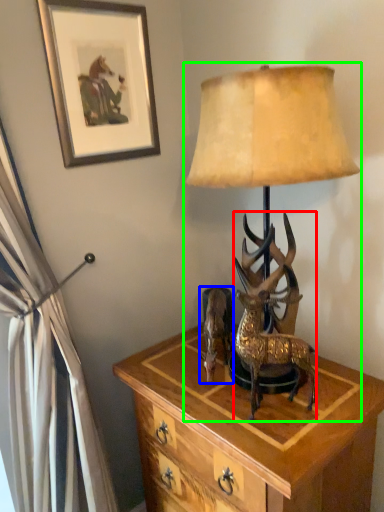
Question: Which is farther away from deer (highlighted by a red box)? reindeer (highlighted by a blue box) or lamp (highlighted by a green box)?

Choices:
 (A) reindeer
 (B) lamp

Answer: (B)